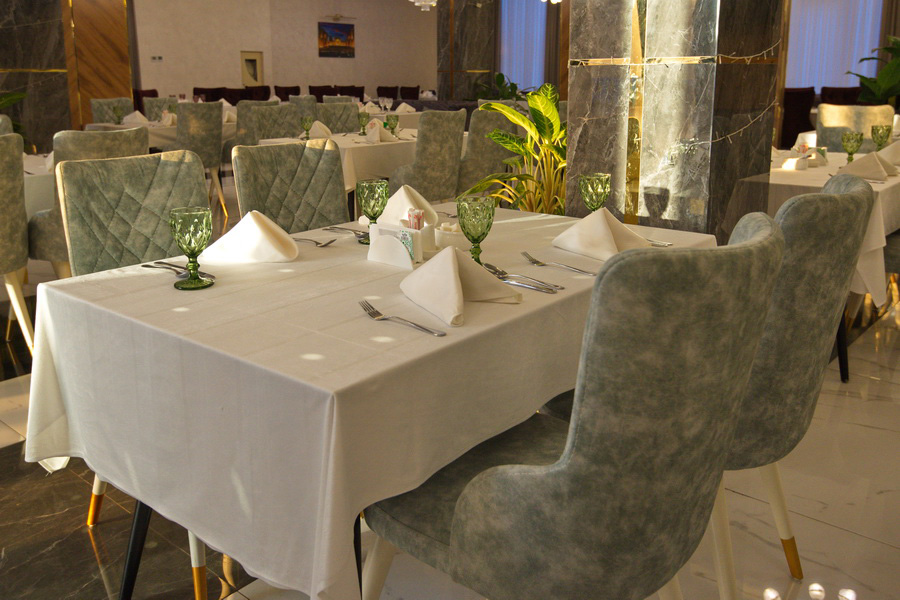
This screenshot has height=600, width=900. Identify the location of linen tablecoths. (293, 398), (45, 183), (367, 143), (164, 127), (411, 112), (804, 173).